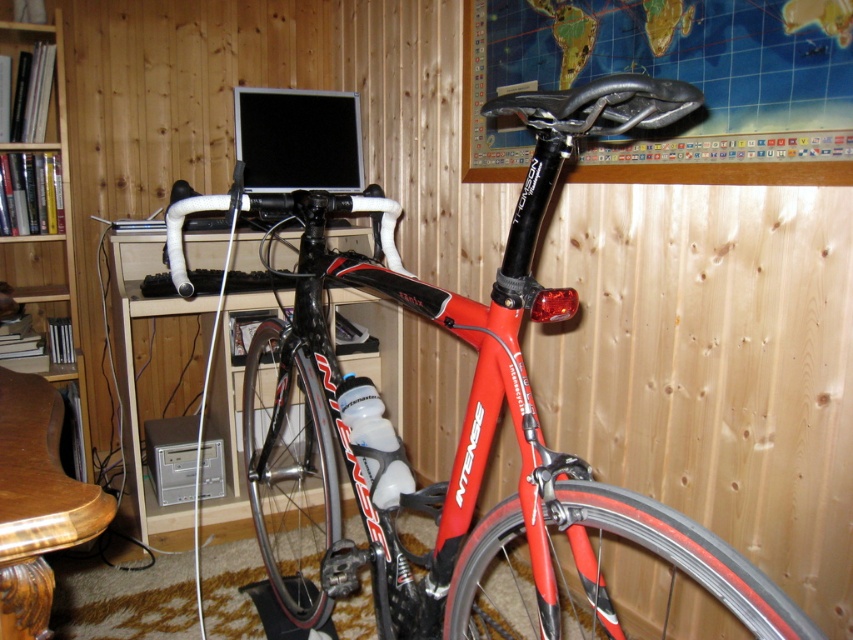
You are a delivery person who needs to move the shiny red bicycle at center and the wooden polished table at lower left into a storage room. The storage room has a height limit of 1.5 meters. Can both items fit vertically without bending them?

The shiny red bicycle at center is taller than the wooden polished table at lower left. Since the storage room has a 1.5 meters height limit, we need to know the exact height of the bicycle to determine if it can fit. However, the description does not provide specific measurements. Therefore, it is uncertain if both items can fit vertically without bending them.

You are setting up a photo shoot and need to know the height relationship between the shiny red bicycle at center and the wooden bookshelf at left. Which one is taller?

The wooden bookshelf at left is taller than the shiny red bicycle at center.

You are an interior designer planning to move the shiny red bicycle at center and the wooden bookshelf at left to a new location. If you need to arrange them side by side in a narrow hallway, which object should be placed first to ensure they both fit?

The wooden bookshelf at left should be placed first because the shiny red bicycle at center is wider than the wooden bookshelf at left, so placing the narrower object first allows more space for the wider one to fit alongside.